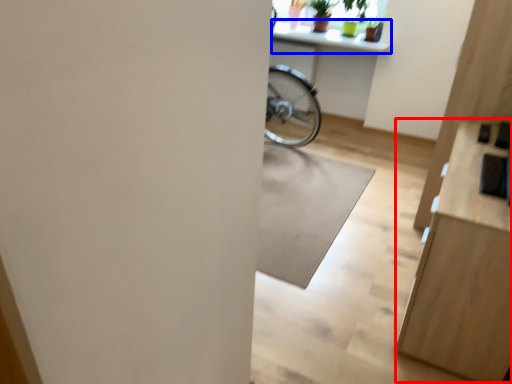
Question: Which object appears farthest to the camera in this image, dresser (highlighted by a red box) or counter top (highlighted by a blue box)?

Choices:
 (A) dresser
 (B) counter top

Answer: (B)